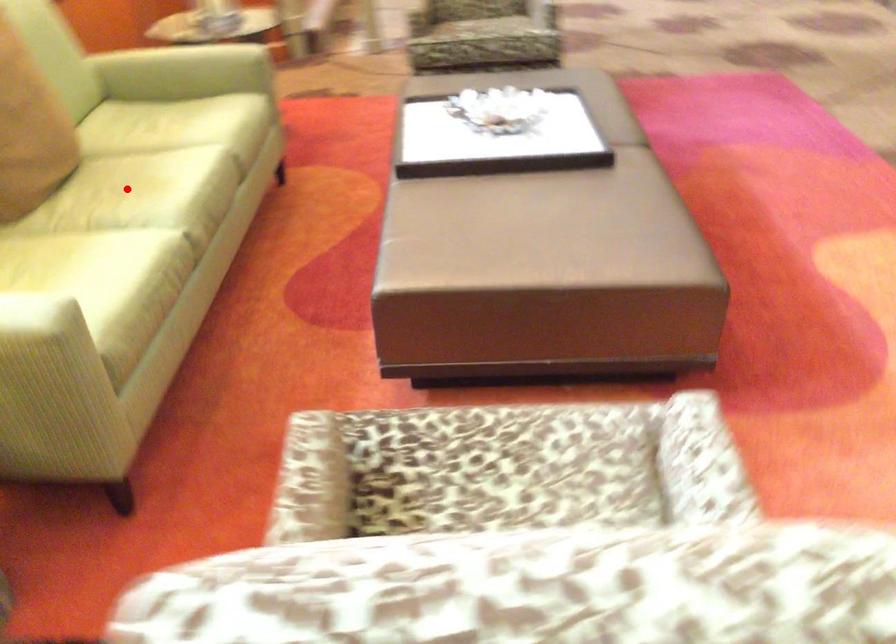
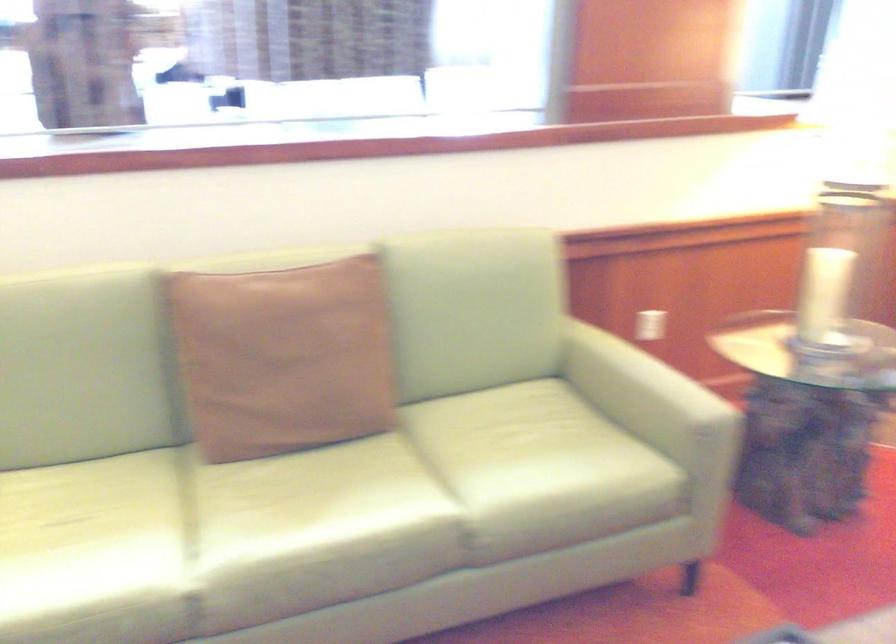
Find the pixel in the second image that matches the highlighted location in the first image.

(299, 498)